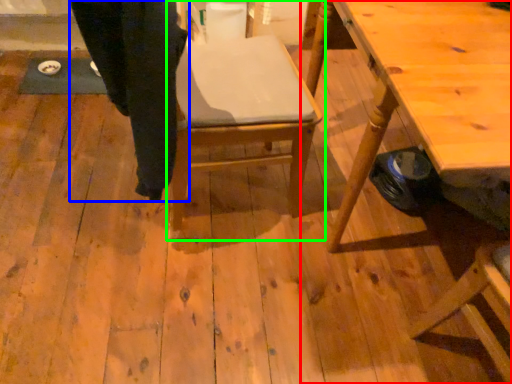
Question: Which object is the closest to the table (highlighted by a red box)? Choose among these: trousers (highlighted by a blue box) or chair (highlighted by a green box).

Choices:
 (A) trousers
 (B) chair

Answer: (B)